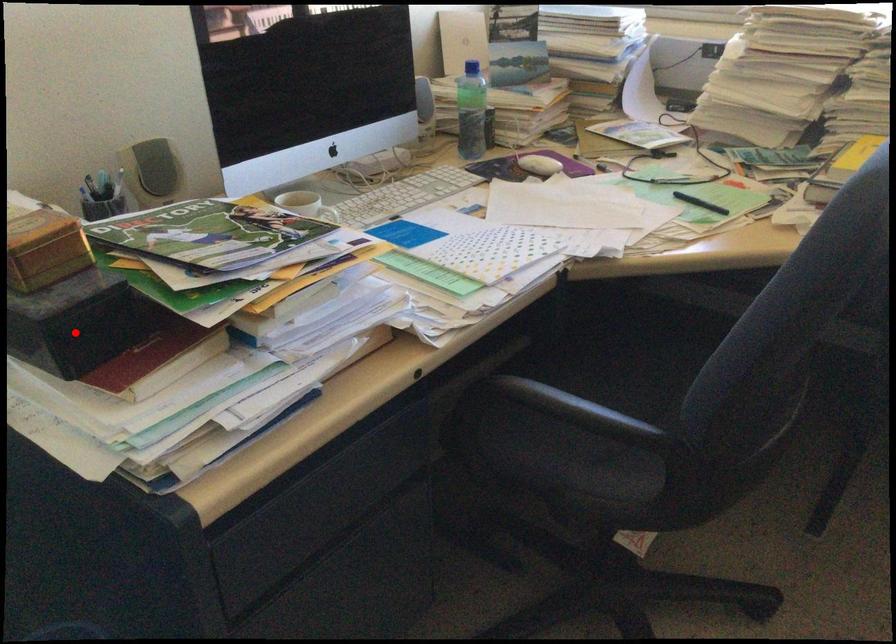
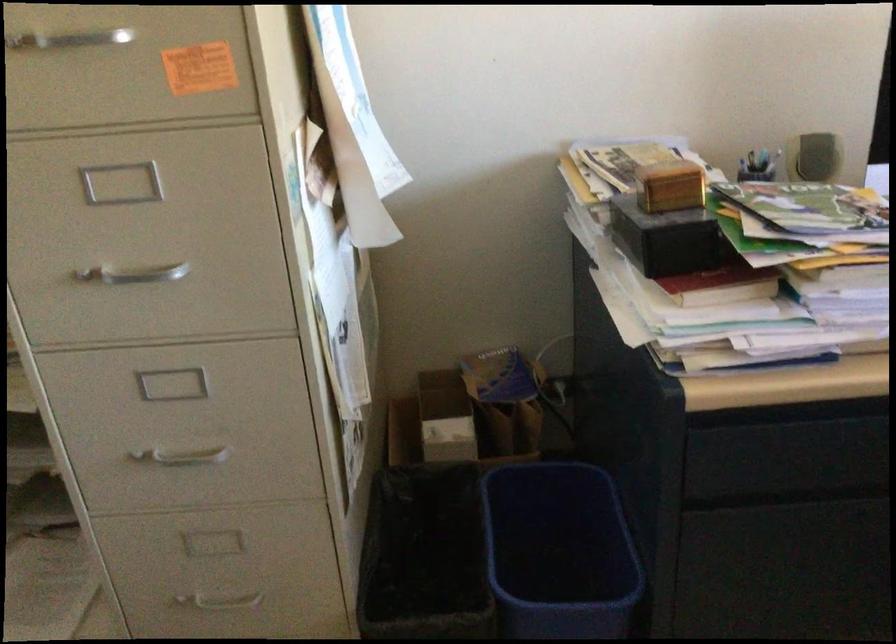
Question: A red point is marked in image1. In image2, is the corresponding 3D point closer to the camera or farther? Reply with the corresponding letter.

Choices:
 (A) The corresponding 3D point is closer.
 (B) The corresponding 3D point is farther.

Answer: (B)